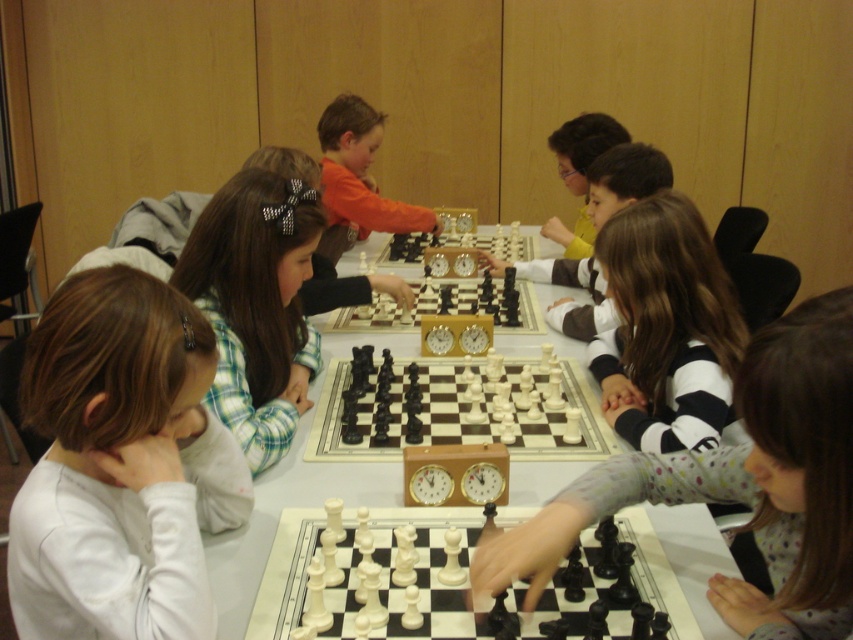
You are a photographer at the chess tournament and want to ensure both the white matte shirt at lower left and the polka dot fabric shirt at center are visible in your photo. Since you can adjust the camera zoom, which shirt should you focus on to capture both without cropping?

You should focus on the white matte shirt at lower left because it is smaller in size compared to the polka dot fabric shirt at center, so zooming in on it will naturally include the larger shirt in the frame.

In the scene shown: You are a photographer standing behind the children at the chess tournament. You want to take a photo of the orange fabric shirt at center and the matte black chess piece at center. Can you fit both subjects into your camera frame if your camera has a maximum width capacity of 30 inches?

The orange fabric shirt at center and matte black chess piece at center are 29.22 inches apart, so yes, both subjects can fit into the camera frame since the distance between them is less than the 30 inches maximum width capacity.

Consider the image. You are a photographer positioned at the back of the room. You want to take a picture of the white matte shirt at lower left and the polka dot fabric shirt at center in the same frame. Given that your camera has a maximum focus range of 20 inches, will you be able to capture both shirts in focus without moving closer?

The white matte shirt at lower left and polka dot fabric shirt at center are 21.88 inches apart, which exceeds the camera maximum focus range of 20 inches. Therefore, you won not be able to capture both shirts in focus without moving closer.